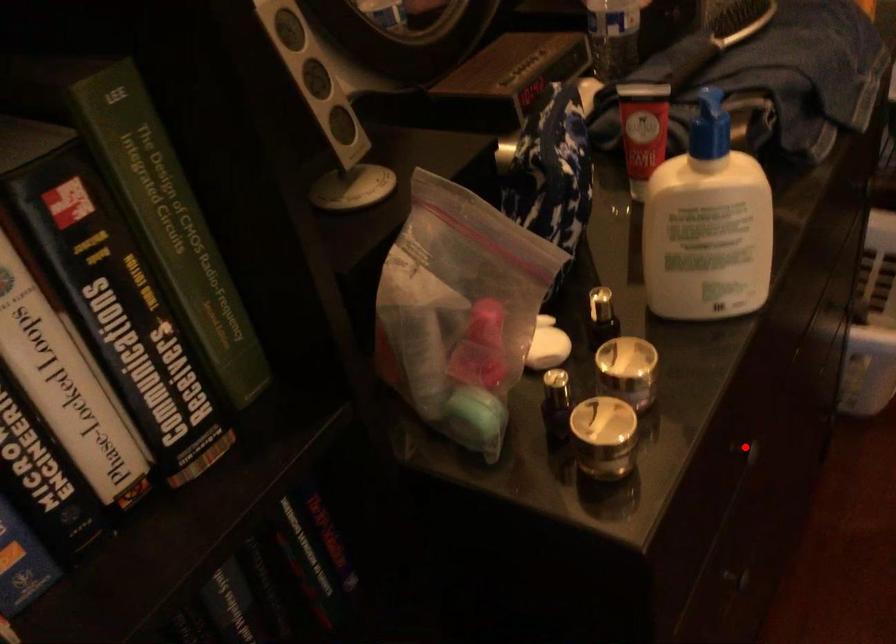
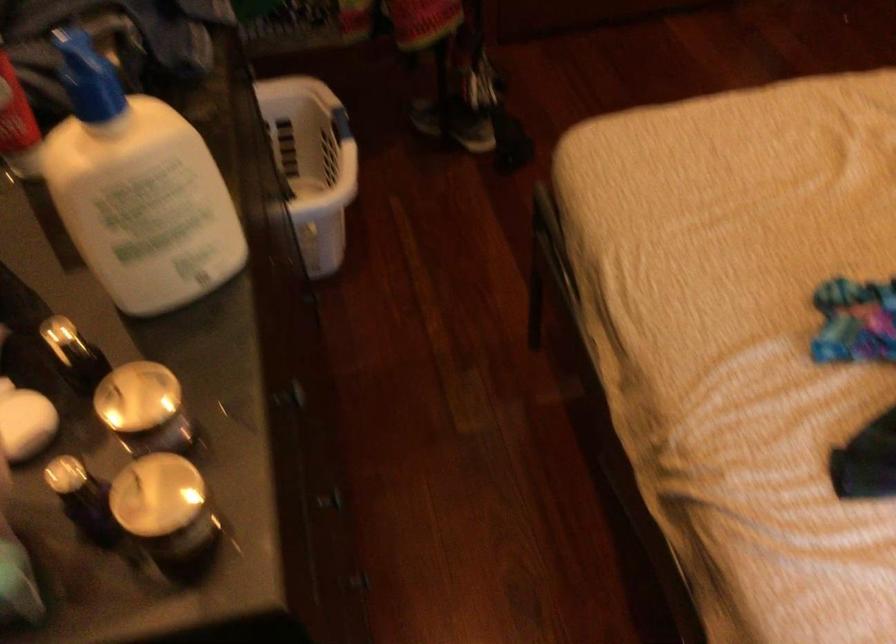
Question: A red point is marked in image1. In image2, is the corresponding 3D point closer to the camera or farther? Reply with the corresponding letter.

Choices:
 (A) The corresponding 3D point is closer.
 (B) The corresponding 3D point is farther.

Answer: (A)